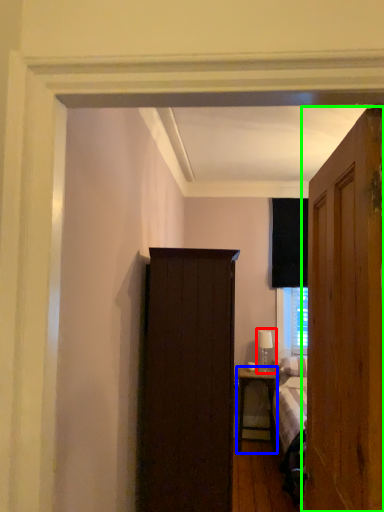
Question: Estimate the real-world distances between objects in this image. Which object is farther from table lamp (highlighted by a red box), nightstand (highlighted by a blue box) or door (highlighted by a green box)?

Choices:
 (A) nightstand
 (B) door

Answer: (B)